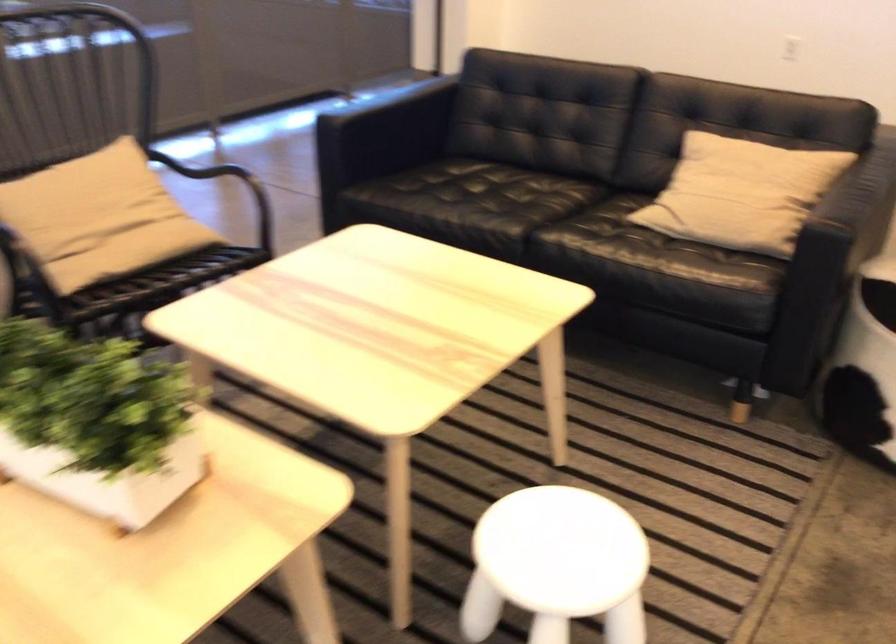
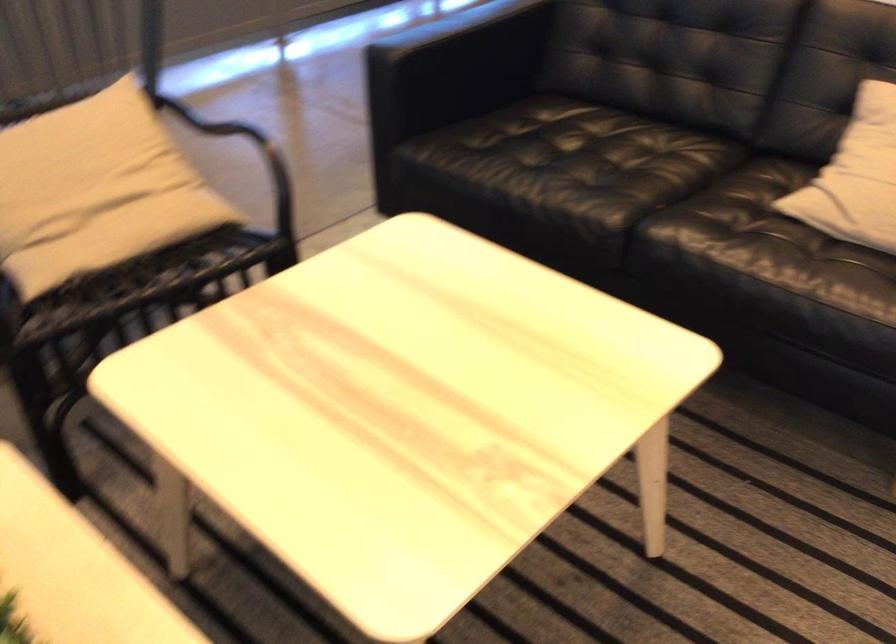
Question: The first image is from the beginning of the video and the second image is from the end. How did the camera likely rotate when shooting the video?

Choices:
 (A) Left
 (B) Right
 (C) Up
 (D) Down

Answer: (D)